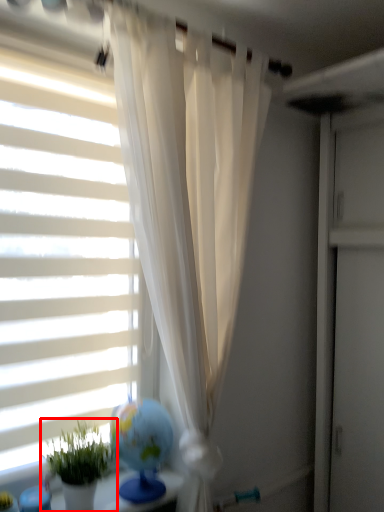
Question: Where is houseplant (annotated by the red box) located in relation to window blind in the image?

Choices:
 (A) left
 (B) right

Answer: (B)